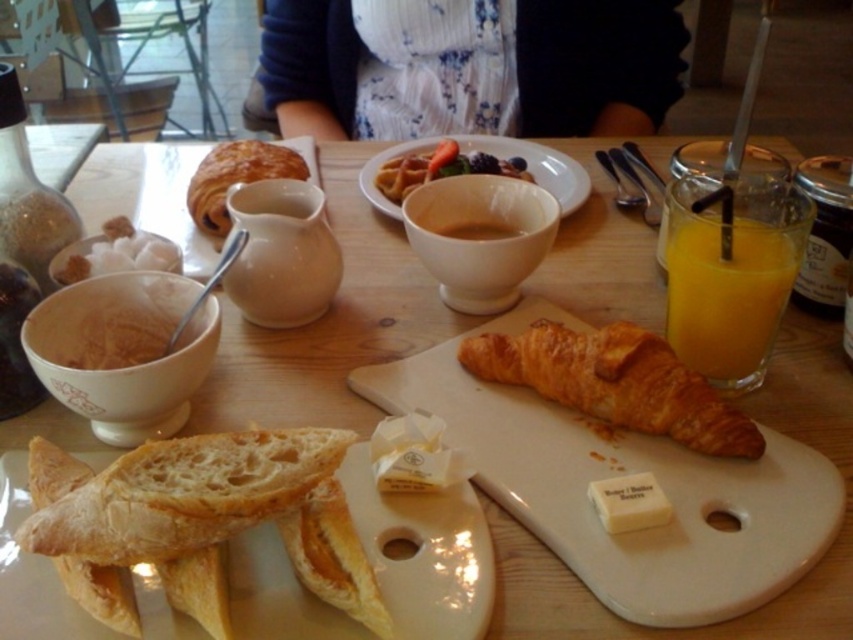
Question: Is golden brown bread at center positioned at the back of golden brown croissant at upper left?

Choices:
 (A) no
 (B) yes

Answer: (A)

Question: Which of the following is the closest to the observer?

Choices:
 (A) (339, 634)
 (B) (640, 515)
 (C) (296, 461)

Answer: (A)

Question: Among these points, which one is nearest to the camera?

Choices:
 (A) (730, 433)
 (B) (830, 490)
 (C) (199, 168)
 (D) (756, 376)

Answer: (B)

Question: Does translucent glass cup at right have a smaller size compared to golden brown croissant at upper left?

Choices:
 (A) no
 (B) yes

Answer: (B)

Question: Which object is closer to the camera taking this photo?

Choices:
 (A) golden brown croissant at upper left
 (B) golden brown flaky croissant at center-right
 (C) white soft butter at center
 (D) matte white bowl at center

Answer: (C)

Question: Is white ceramic platter at center wider than white soft butter at center?

Choices:
 (A) yes
 (B) no

Answer: (A)